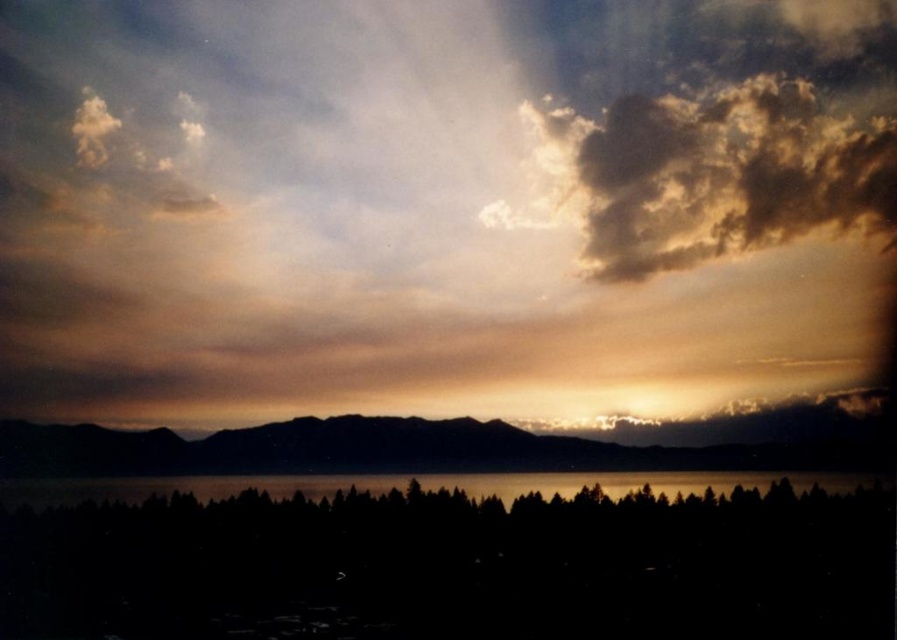
Question: Which point appears farthest from the camera in this image?

Choices:
 (A) (736, 156)
 (B) (684, 602)
 (C) (353, 60)
 (D) (150, 456)

Answer: (D)

Question: Among these objects, which one is nearest to the camera?

Choices:
 (A) black matte trees at bottom
 (B) black water at center
 (C) smokey gray cloud at upper center
 (D) silhouette mountain at center

Answer: (A)

Question: Is silhouette mountain at center further to camera compared to black water at center?

Choices:
 (A) no
 (B) yes

Answer: (A)

Question: Is silhouette mountain at center wider than black water at center?

Choices:
 (A) no
 (B) yes

Answer: (B)

Question: Which point is farther to the camera?

Choices:
 (A) silhouette mountain at center
 (B) golden textured cloud at upper right
 (C) black matte trees at bottom
 (D) smokey gray cloud at upper center

Answer: (A)

Question: Does black matte trees at bottom have a smaller size compared to silhouette mountain at center?

Choices:
 (A) yes
 (B) no

Answer: (B)